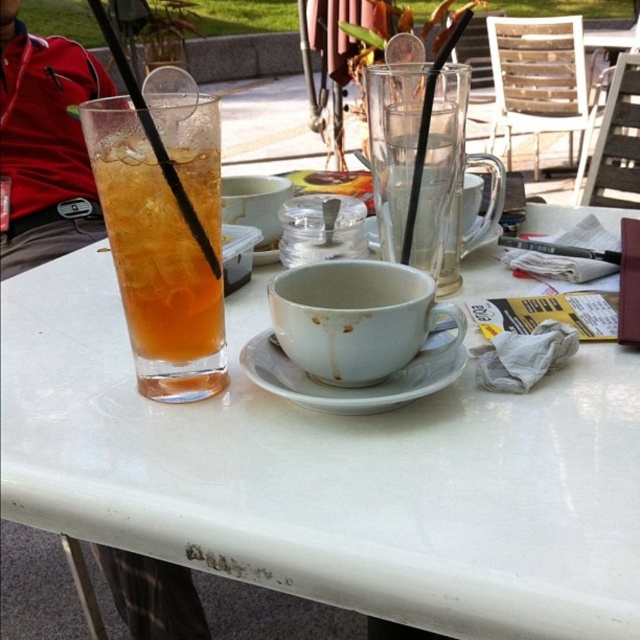
You are sitting at the outdoor cafe table and want to reach for the item at point [148,625]. Is the item at point [163,301] blocking your path?

Point [163,301] is in front of point [148,625], so the item at point [163,301] is blocking the path to the item at point [148,625].

You are a customer at the outdoor cafe and want to choose a drink container that is taller. Which one should you pick between the transparent glass cup at upper left and the red fabric jacket at left?

The transparent glass cup at upper left is shorter than the red fabric jacket at left, so you should pick the red fabric jacket at left as it is taller.